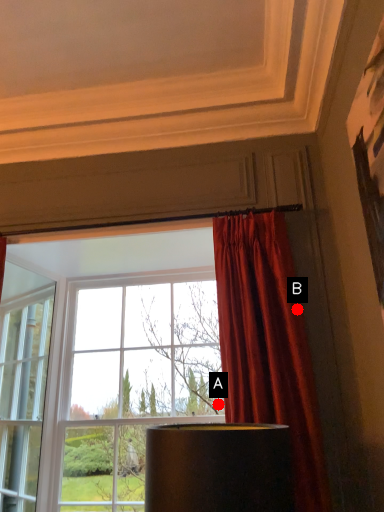
Question: Two points are circled on the image, labeled by A and B beside each circle. Which point is farther from the camera taking this photo?

Choices:
 (A) A is further
 (B) B is further

Answer: (A)